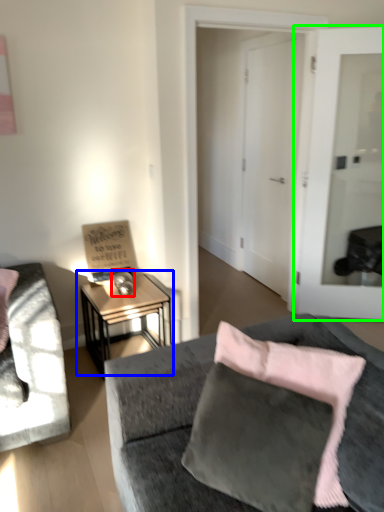
Question: Based on their relative distances, which object is farther from table lamp (highlighted by a red box)? Choose from table (highlighted by a blue box) and door (highlighted by a green box).

Choices:
 (A) table
 (B) door

Answer: (B)